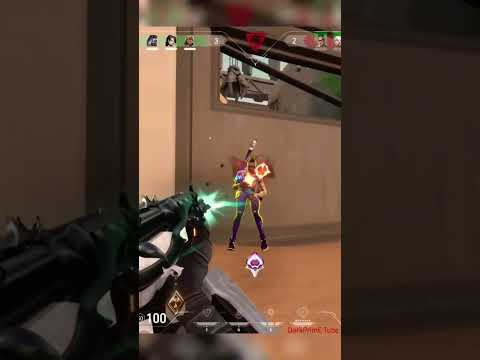
The width and height of the screenshot is (480, 360). I want to click on 1 window, so click(310, 102).